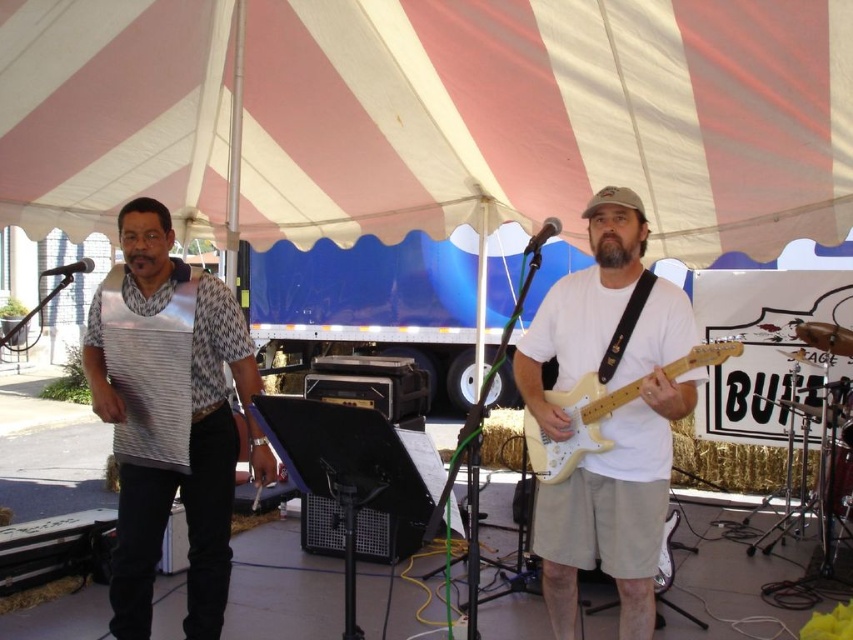
Question: Can you confirm if white matte guitar at center is thinner than white matte electric guitar at center?

Choices:
 (A) yes
 (B) no

Answer: (A)

Question: Considering the real-world distances, which object is closest to the white matte guitar at center?

Choices:
 (A) white matte electric guitar at center
 (B) metallic washboard at left

Answer: (A)

Question: Which point appears closest to the camera in this image?

Choices:
 (A) (257, 444)
 (B) (154, 273)

Answer: (B)

Question: Which is farther from the metallic silver harmonica at center?

Choices:
 (A) white matte electric guitar at center
 (B) white matte guitar at center

Answer: (B)

Question: Can you confirm if metallic washboard at left is smaller than white matte electric guitar at center?

Choices:
 (A) yes
 (B) no

Answer: (B)

Question: Does metallic washboard at left appear under white matte electric guitar at center?

Choices:
 (A) yes
 (B) no

Answer: (A)